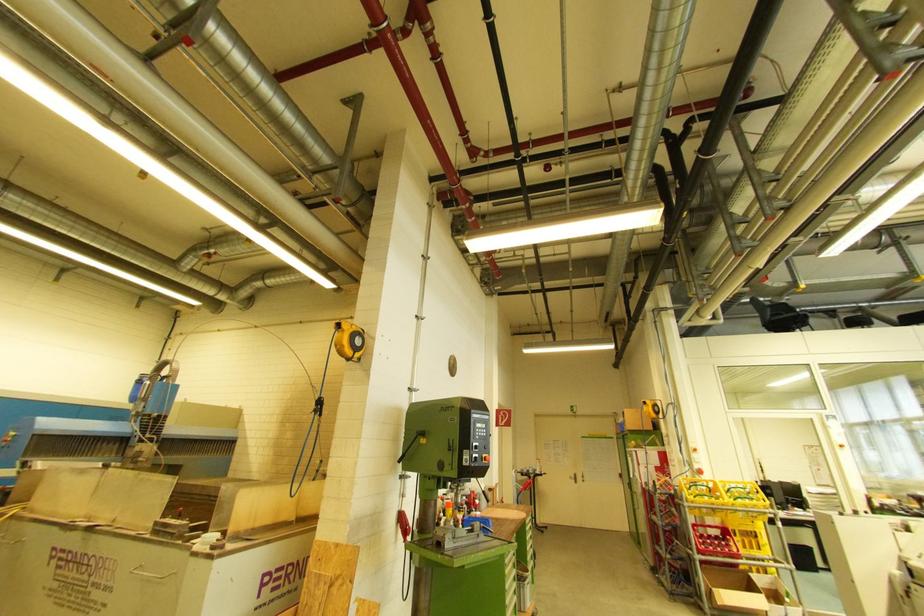
The height and width of the screenshot is (616, 924). What do you see at coordinates (779, 315) in the screenshot?
I see `a chair armrest` at bounding box center [779, 315].